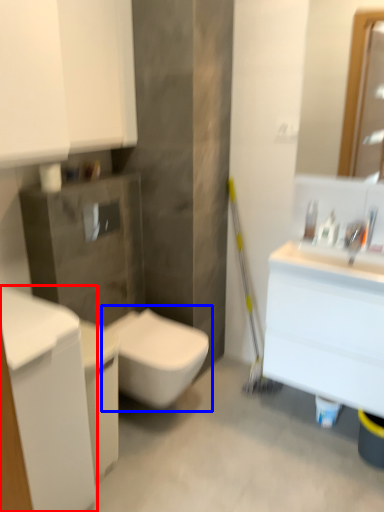
Question: Among these objects, which one is nearest to the camera, cabinetry (highlighted by a red box) or toilet (highlighted by a blue box)?

Choices:
 (A) cabinetry
 (B) toilet

Answer: (A)